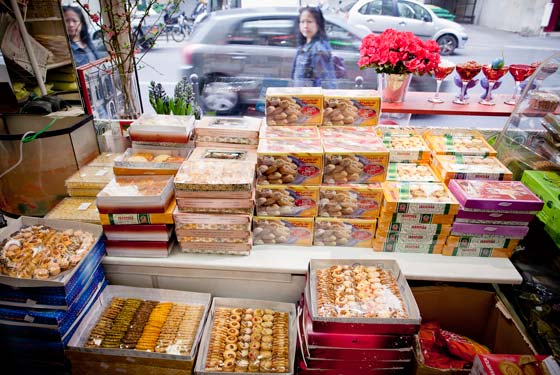
Locate an element on the screen. Image resolution: width=560 pixels, height=375 pixels. window is located at coordinates (247, 82).